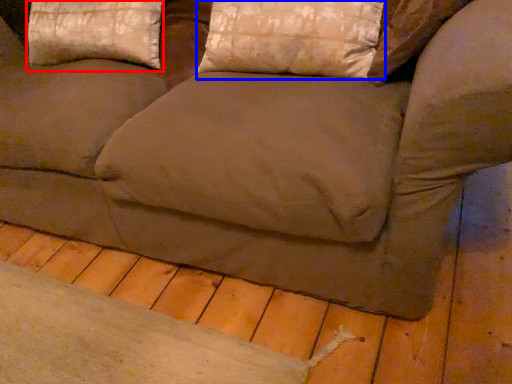
Question: Which object is closer to the camera taking this photo, pillow (highlighted by a red box) or pillow (highlighted by a blue box)?

Choices:
 (A) pillow
 (B) pillow

Answer: (B)